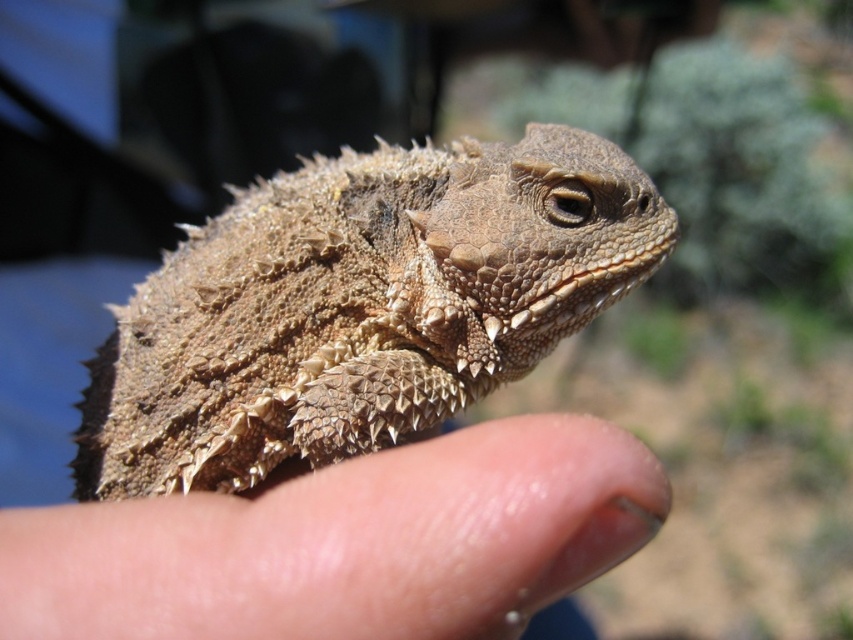
Between brown scaly lizard at center and dry skin at center, which one has less height?

dry skin at center is shorter.

Measure the distance between brown scaly lizard at center and dry skin at center.

brown scaly lizard at center is 1.03 meters from dry skin at center.

Which is behind, point (318, 164) or point (253, 506)?

The point (318, 164) is more distant.

Identify the location of brown scaly lizard at center. Image resolution: width=853 pixels, height=640 pixels. (360, 307).